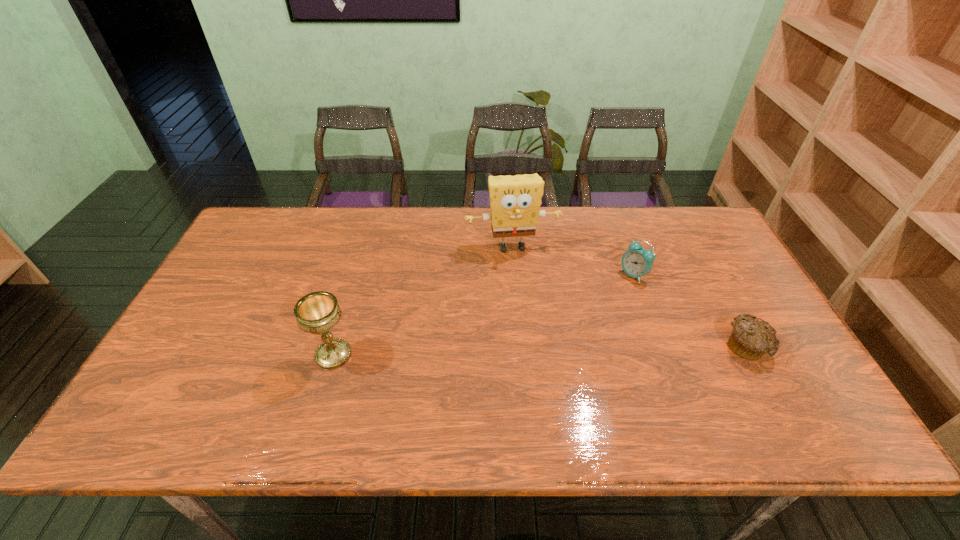
Locate an element on the screen. Image resolution: width=960 pixels, height=540 pixels. chalice is located at coordinates (318, 312).

Image resolution: width=960 pixels, height=540 pixels. In order to click on the leftmost object in this screenshot , I will do `click(318, 312)`.

Where is `muffin`? muffin is located at coordinates (750, 339).

At what (x,y) coordinates should I click in order to perform the action: click on the shortest object. Please return your answer as a coordinate pair (x, y). The image size is (960, 540). Looking at the image, I should click on (750, 339).

Where is `the third object from right to left`? the third object from right to left is located at coordinates (515, 201).

The height and width of the screenshot is (540, 960). In order to click on the farthest object in this screenshot , I will do `click(515, 201)`.

Find the location of a particular element. The image size is (960, 540). the third object from left to right is located at coordinates (637, 262).

This screenshot has width=960, height=540. Identify the location of alarm clock. (637, 262).

Identify the location of vacant space located on the back of the chalice. (358, 270).

You are a GUI agent. You are given a task and a screenshot of the screen. Output one action in this format:
    pyautogui.click(x=<x>, y=<y>)
    Task: Click on the free spot located on the left of the muffin
    This screenshot has height=540, width=960.
    Given the screenshot: What is the action you would take?
    pyautogui.click(x=615, y=347)